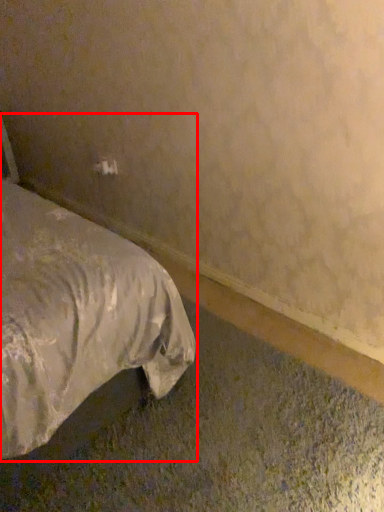
Question: Observing the image, what is the correct spatial positioning of bed (annotated by the red box) in reference to electric outlet?

Choices:
 (A) right
 (B) left

Answer: (B)